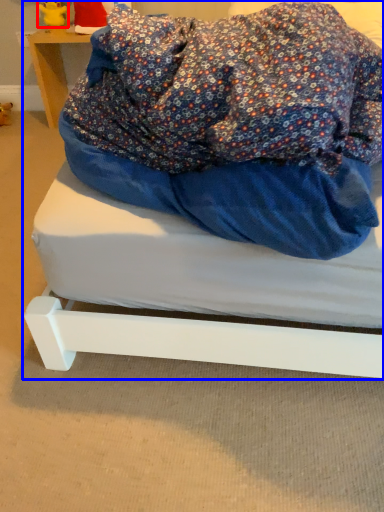
Question: Which point is closer to the camera, figurine (highlighted by a red box) or bed (highlighted by a blue box)?

Choices:
 (A) figurine
 (B) bed

Answer: (B)